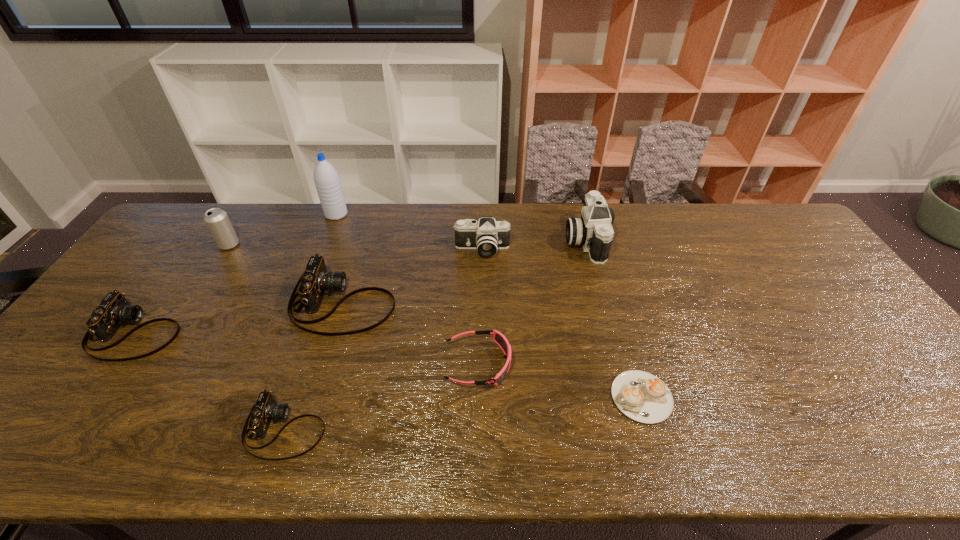
Locate an element on the screen. This screenshot has height=540, width=960. vacant region that satisfies the following two spatial constraints: 1. on the front side of the shortest object; 2. on the right side of the tallest camera is located at coordinates (627, 397).

At what (x,y) coordinates should I click in order to perform the action: click on free space in the image that satisfies the following two spatial constraints: 1. on the front-facing side of the pink goggles; 2. on the back side of the cappuccino. Please return your answer as a coordinate pair (x, y). The height and width of the screenshot is (540, 960). Looking at the image, I should click on 478,397.